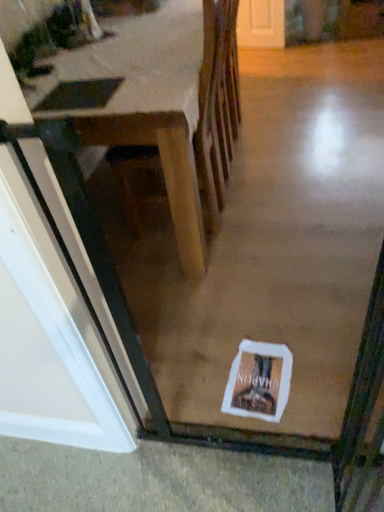
You are a GUI agent. You are given a task and a screenshot of the screen. Output one action in this format:
    pyautogui.click(x=<x>, y=<y>)
    Task: Click on the blank space above white paper postcard at center (from a real-world perspective)
    
    Given the screenshot: What is the action you would take?
    257,379